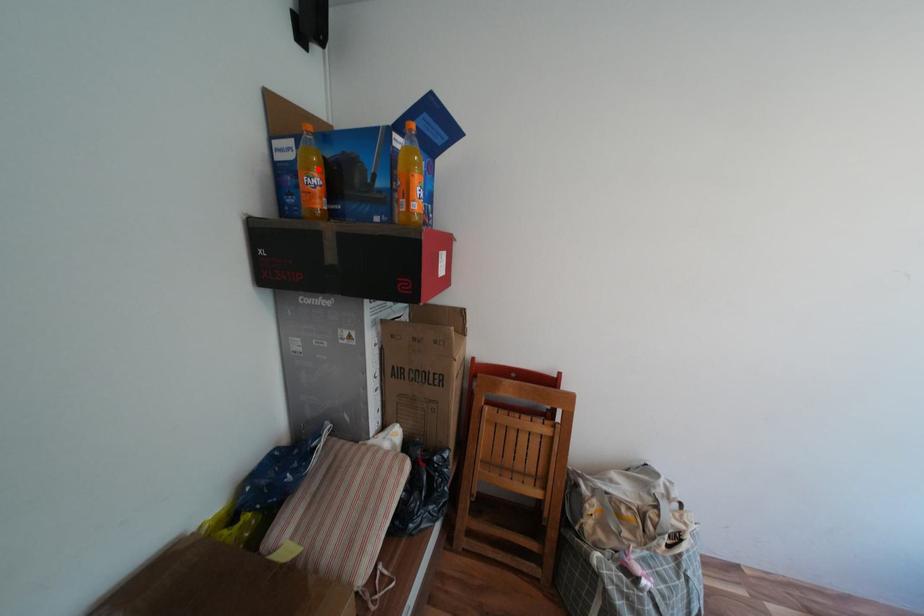
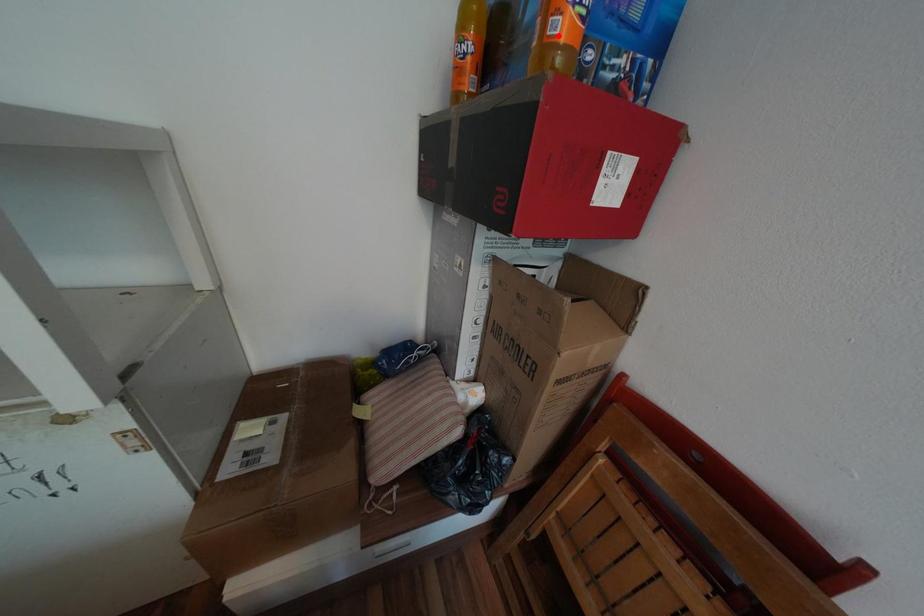
I am providing you with two images of the same scene from different viewpoints. A red point is marked on the first image and another point is marked on the second image. Do the highlighted points in image1 and image2 indicate the same real-world spot?

No